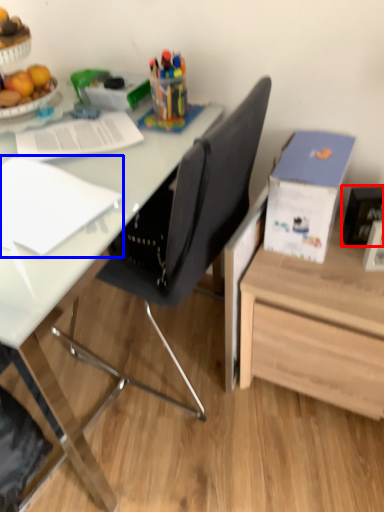
Question: Among these objects, which one is farthest to the camera, picture frame (highlighted by a red box) or notebook (highlighted by a blue box)?

Choices:
 (A) picture frame
 (B) notebook

Answer: (A)